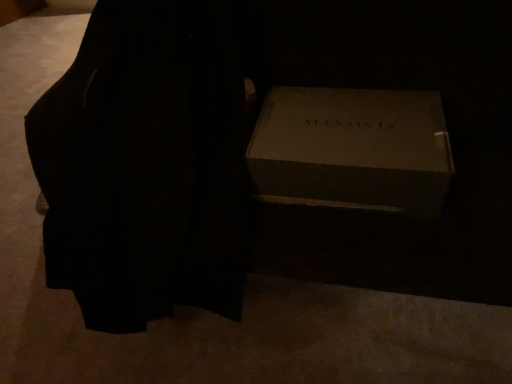
Question: Could black velvet dress at center be considered to be inside matte cardboard box at center?

Choices:
 (A) yes
 (B) no

Answer: (B)

Question: From the image's perspective, does matte cardboard box at center appear lower than black velvet dress at center?

Choices:
 (A) no
 (B) yes

Answer: (B)

Question: Is matte cardboard box at center thinner than black velvet dress at center?

Choices:
 (A) no
 (B) yes

Answer: (B)

Question: From the image's perspective, is matte cardboard box at center on black velvet dress at center?

Choices:
 (A) yes
 (B) no

Answer: (B)

Question: Is matte cardboard box at center in contact with black velvet dress at center?

Choices:
 (A) yes
 (B) no

Answer: (B)

Question: From a real-world perspective, is matte cardboard box at center physically above black velvet dress at center?

Choices:
 (A) yes
 (B) no

Answer: (A)

Question: Can we say black velvet dress at center lies outside matte cardboard box at center?

Choices:
 (A) yes
 (B) no

Answer: (A)

Question: Does black velvet dress at center have a lesser height compared to matte cardboard box at center?

Choices:
 (A) yes
 (B) no

Answer: (B)

Question: Can matte cardboard box at center be found inside black velvet dress at center?

Choices:
 (A) no
 (B) yes

Answer: (A)

Question: Does black velvet dress at center come in front of matte cardboard box at center?

Choices:
 (A) no
 (B) yes

Answer: (B)

Question: Is black velvet dress at center behind matte cardboard box at center?

Choices:
 (A) no
 (B) yes

Answer: (A)

Question: Does black velvet dress at center appear on the left side of matte cardboard box at center?

Choices:
 (A) yes
 (B) no

Answer: (A)

Question: In terms of size, does black velvet dress at center appear bigger or smaller than matte cardboard box at center?

Choices:
 (A) small
 (B) big

Answer: (B)